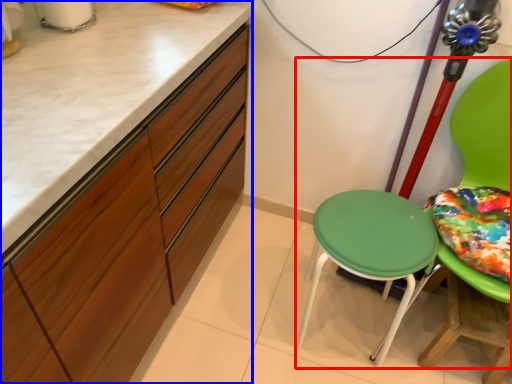
Question: Which object appears farthest to the camera in this image, chair (highlighted by a red box) or cabinetry (highlighted by a blue box)?

Choices:
 (A) chair
 (B) cabinetry

Answer: (A)